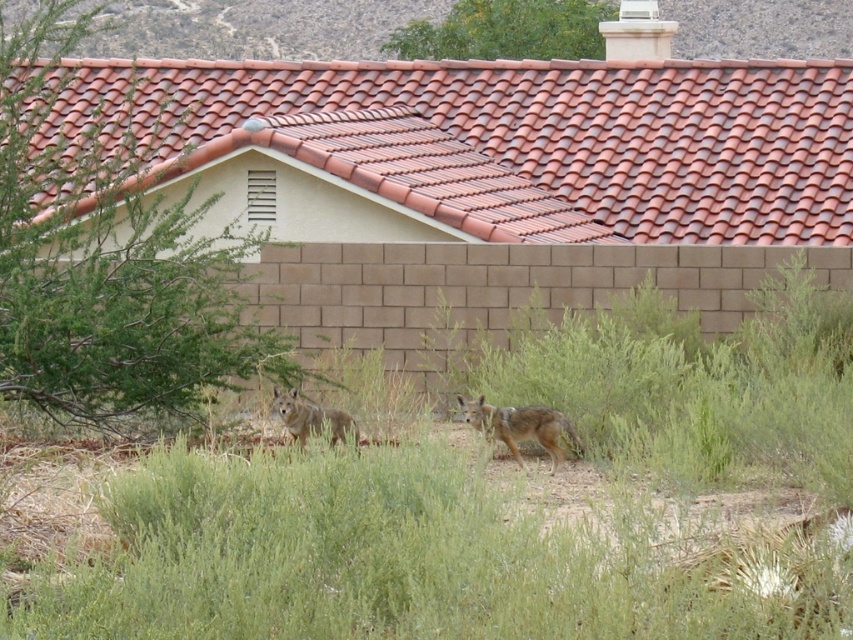
Question: Which object is positioned farthest from the green leafy bush at upper center?

Choices:
 (A) terracotta clay tiles at upper center
 (B) brown fur coyote at center
 (C) green leafy grass at center

Answer: (C)

Question: Does terracotta clay tiles at upper center appear on the left side of fur-like coyote at center?

Choices:
 (A) no
 (B) yes

Answer: (B)

Question: Can you confirm if brown fur coyote at center is positioned below fur-like coyote at center?

Choices:
 (A) yes
 (B) no

Answer: (A)

Question: Where is terracotta clay tiles at upper center located in relation to green leafy bush at upper center in the image?

Choices:
 (A) left
 (B) right

Answer: (B)

Question: Which object is the farthest from the fur-like coyote at center?

Choices:
 (A) green leafy bush at left
 (B) green leafy bush at upper center
 (C) terracotta clay tiles at upper center
 (D) brown fur coyote at center

Answer: (B)

Question: Which of the following is the farthest from the observer?

Choices:
 (A) (544, 422)
 (B) (281, 419)

Answer: (B)